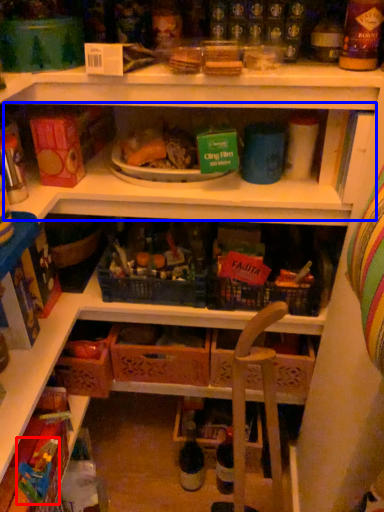
Question: Which object appears closest to the camera in this image, toy (highlighted by a red box) or shelf (highlighted by a blue box)?

Choices:
 (A) toy
 (B) shelf

Answer: (A)